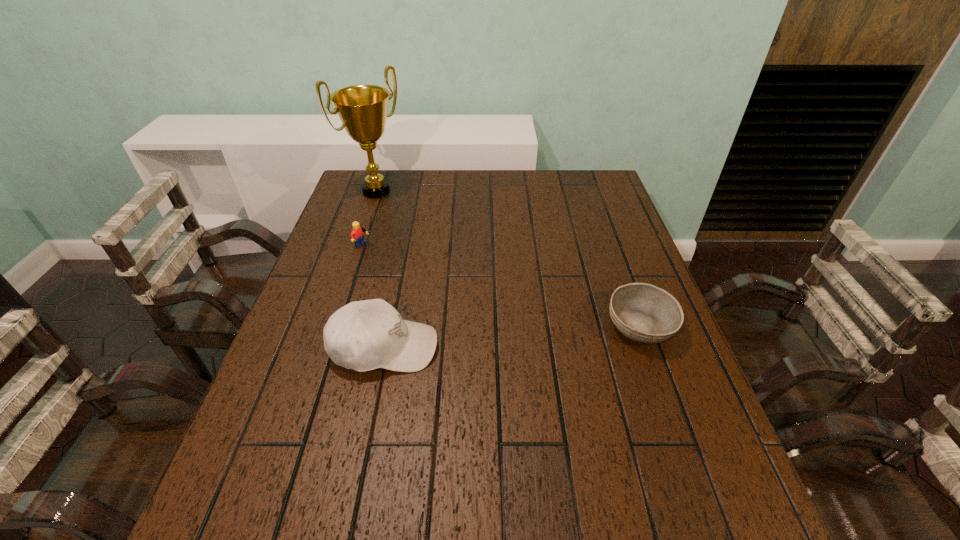
Locate an element on the screen. This screenshot has width=960, height=540. baseball cap is located at coordinates (365, 335).

In order to click on the shortest object in this screenshot , I will do `click(642, 312)`.

Image resolution: width=960 pixels, height=540 pixels. What are the coordinates of `bowl` in the screenshot? It's located at (642, 312).

Image resolution: width=960 pixels, height=540 pixels. In order to click on the second farthest object in this screenshot , I will do pyautogui.click(x=357, y=235).

At what (x,y) coordinates should I click in order to perform the action: click on the tallest object. Please return your answer as a coordinate pair (x, y). This screenshot has width=960, height=540. Looking at the image, I should click on (362, 109).

Where is `the farthest object`? This screenshot has height=540, width=960. the farthest object is located at coordinates (362, 109).

Image resolution: width=960 pixels, height=540 pixels. I want to click on vacant position located 0.170m on the front-facing side of the baseball cap, so click(511, 347).

Locate an element on the screen. The height and width of the screenshot is (540, 960). vacant area situated 0.350m on the back of the rightmost object is located at coordinates (603, 223).

Where is `free location located on the front-facing side of the second farthest object`? free location located on the front-facing side of the second farthest object is located at coordinates (434, 280).

Where is `vacant space situated 0.100m on the front-facing side of the second farthest object`? vacant space situated 0.100m on the front-facing side of the second farthest object is located at coordinates (399, 261).